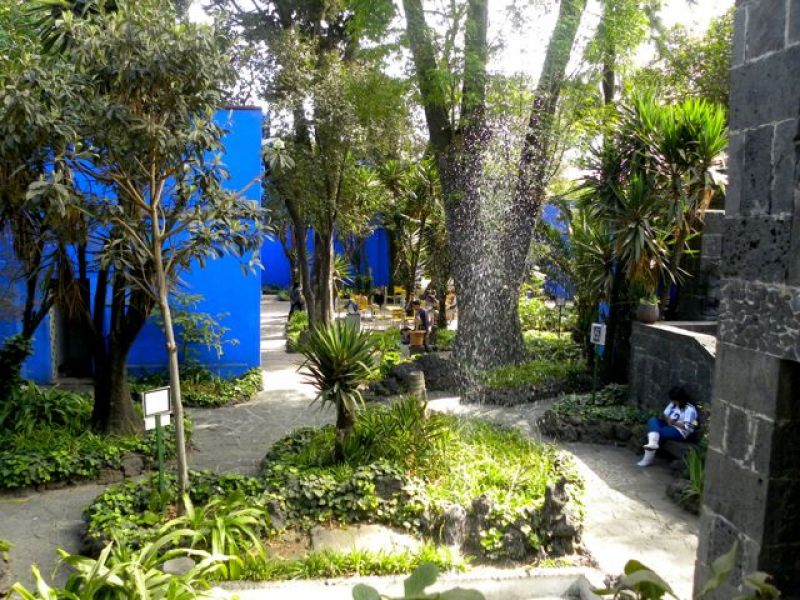
Find the location of a particular element. This screenshot has height=600, width=800. wall is located at coordinates (238, 292), (270, 267), (558, 280).